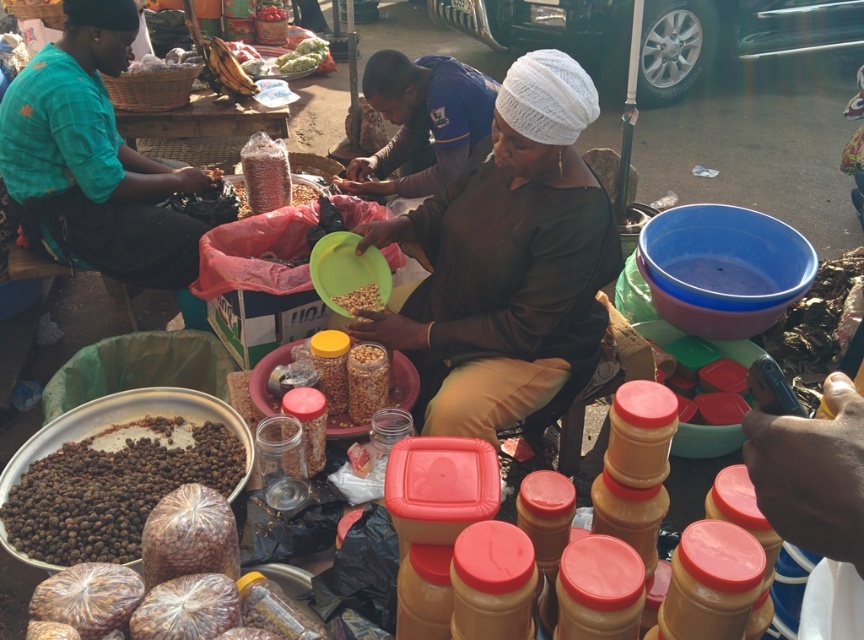
Consider the image. You are a customer at the market and want to buy both the green leafy vegetables at center and the brown matte grains at center. Which one should you approach first if you are standing to the right of both items?

You should approach the green leafy vegetables at center first because it is to the left of the brown matte grains at center, so it is closer to your current position on the right.

You are a customer observing two vendors at the market. One is wearing a matte brown blouse at center, and the other is wearing a blue uniform shirt at center. Which vendor has wider clothing from shoulder to shoulder?

The matte brown blouse at center has a greater width compared to the blue uniform shirt at center, so the vendor wearing the matte brown blouse at center has wider clothing from shoulder to shoulder.

You are a customer standing at the market entrance and want to reach the vendor. The shortest path to her location requires passing through point (562, 140). If your walking speed is 3 feet per second, how many seconds will it take to reach that point?

The distance of point (562, 140) from camera is 6.57 feet. At a speed of 3 feet per second, it will take 6.57 divided by 3 equals approximately 2.19 seconds to reach the point.